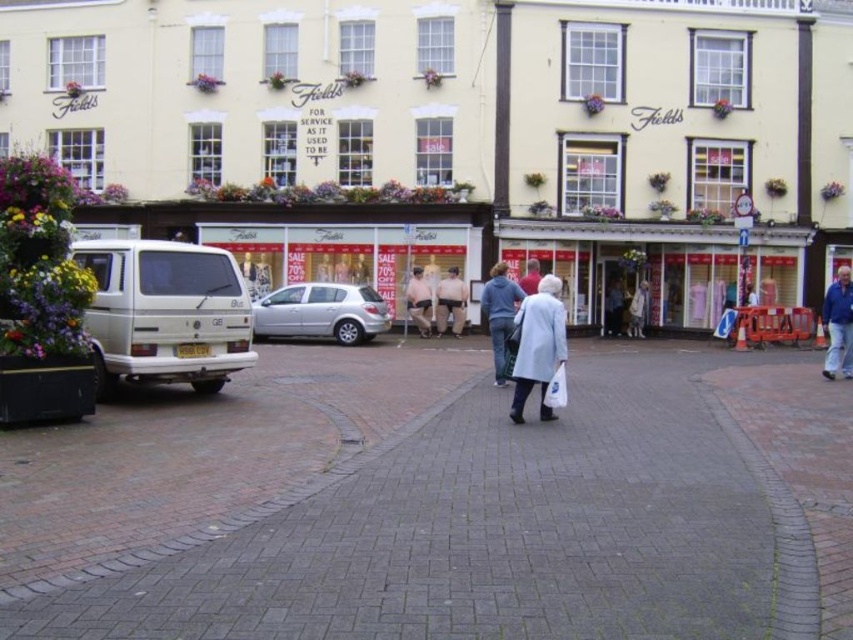
Locate an element on the screen. satin silver hatchback at center is located at coordinates (321, 312).

Between blue cotton shirt at lower right and light blue denim jacket at center, which one has more height?

Standing taller between the two is blue cotton shirt at lower right.

Is point (828, 371) positioned before point (608, 321)?

Yes, point (828, 371) is closer to viewer.

Does point (850, 364) come behind point (618, 292)?

No, it is not.

In order to click on blue cotton shirt at lower right in this screenshot , I will do `click(838, 324)`.

Who is more forward, (630, 336) or (527, 266)?

Point (527, 266)

Does point (643, 289) come closer to viewer compared to point (531, 280)?

No.

At what (x,y) coordinates should I click in order to perform the action: click on light gray coat at center. Please return your answer as a coordinate pair (x, y). Looking at the image, I should click on (637, 308).